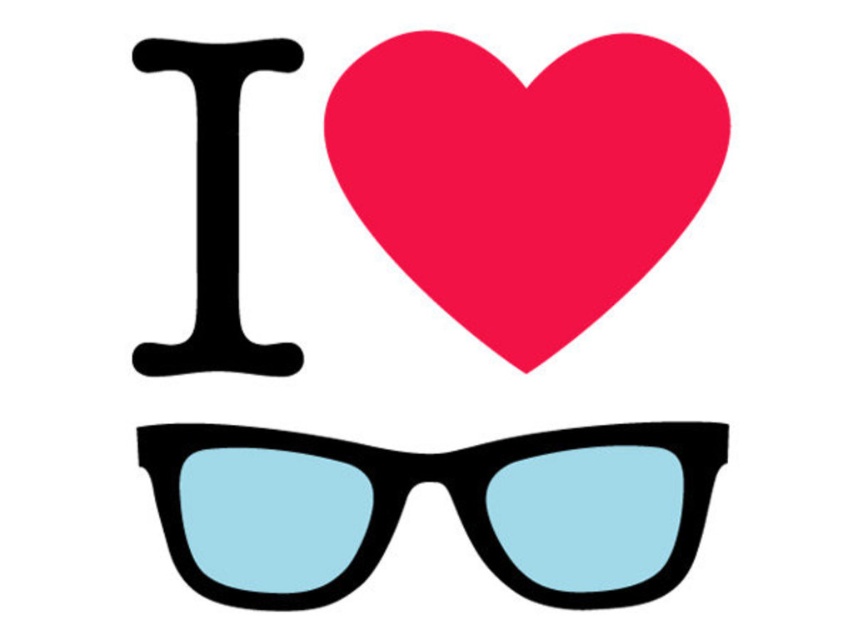
You are designing a logo and need to ensure proper alignment. The logo includes a matte red heart at center and a matte black sunglasses at center. Which object is placed above the other?

The matte red heart at center is positioned over the matte black sunglasses at center, meaning the heart is above the sunglasses.

You are designing a poster and want to ensure proper spacing between the matte red heart at center and the matte black sunglasses at center. According to the design specifications, the minimum required distance between these two elements is 15 centimeters. Based on the image, will the current spacing meet the requirement?

The matte red heart at center is 13.84 centimeters away from the matte black sunglasses at center, which is less than the required 15 centimeters. Therefore, the current spacing does not meet the requirement.